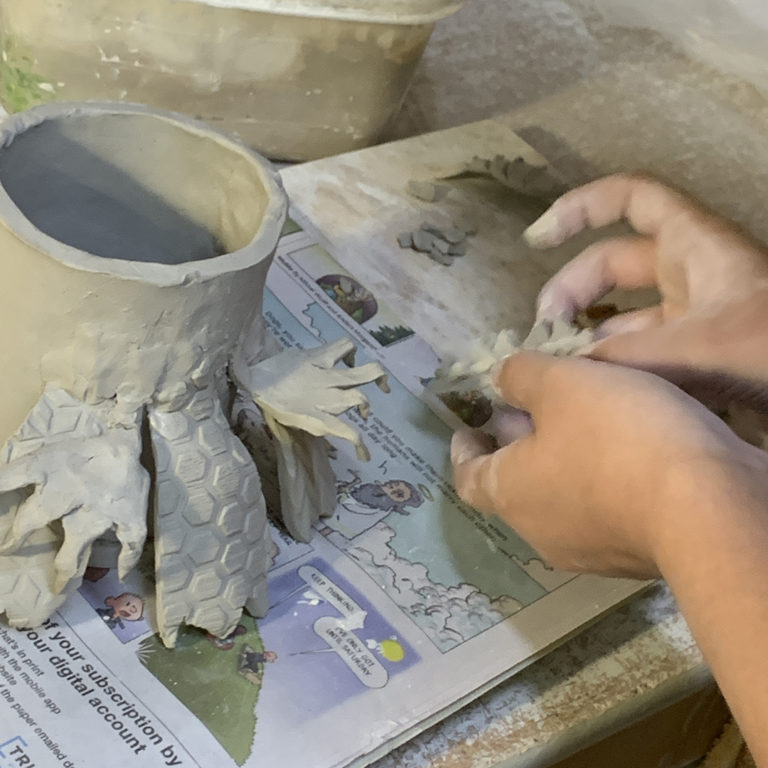
Locate an element on the screen. The height and width of the screenshot is (768, 768). empty space on work table is located at coordinates (680, 61).